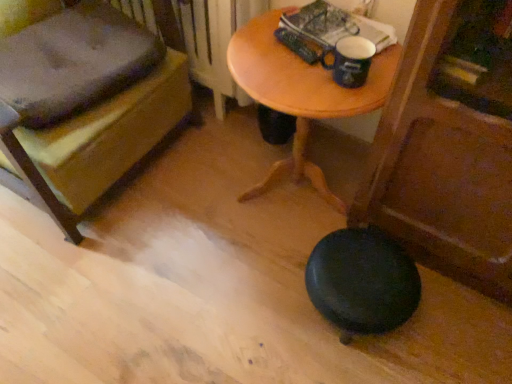
Question: Is wooden bench at lower left to the right of black rubber stool at lower right from the viewer's perspective?

Choices:
 (A) no
 (B) yes

Answer: (A)

Question: From the image's perspective, is wooden bench at lower left located beneath black rubber stool at lower right?

Choices:
 (A) yes
 (B) no

Answer: (B)

Question: From the image's perspective, is wooden bench at lower left on black rubber stool at lower right?

Choices:
 (A) yes
 (B) no

Answer: (A)

Question: Is black rubber stool at lower right completely or partially inside wooden bench at lower left?

Choices:
 (A) yes
 (B) no

Answer: (B)

Question: Is wooden bench at lower left positioned far away from black rubber stool at lower right?

Choices:
 (A) no
 (B) yes

Answer: (A)

Question: From the image's perspective, is wooden bench at lower left located above or below white plastic radiator at upper center?

Choices:
 (A) above
 (B) below

Answer: (B)

Question: From their relative heights in the image, would you say wooden bench at lower left is taller or shorter than white plastic radiator at upper center?

Choices:
 (A) short
 (B) tall

Answer: (B)

Question: From a real-world perspective, is wooden bench at lower left positioned above or below white plastic radiator at upper center?

Choices:
 (A) above
 (B) below

Answer: (A)

Question: Based on their sizes in the image, would you say wooden bench at lower left is bigger or smaller than white plastic radiator at upper center?

Choices:
 (A) big
 (B) small

Answer: (A)

Question: Is white plastic radiator at upper center spatially inside wooden table at center, or outside of it?

Choices:
 (A) inside
 (B) outside

Answer: (B)

Question: Is white plastic radiator at upper center bigger or smaller than wooden table at center?

Choices:
 (A) small
 (B) big

Answer: (A)

Question: Is white plastic radiator at upper center wider or thinner than wooden table at center?

Choices:
 (A) wide
 (B) thin

Answer: (B)

Question: Is point (137, 11) positioned closer to the camera than point (267, 54)?

Choices:
 (A) closer
 (B) farther

Answer: (B)

Question: Is point (3, 130) positioned closer to the camera than point (321, 82)?

Choices:
 (A) closer
 (B) farther

Answer: (B)

Question: From the image's perspective, is wooden bench at lower left above or below wooden table at center?

Choices:
 (A) below
 (B) above

Answer: (B)